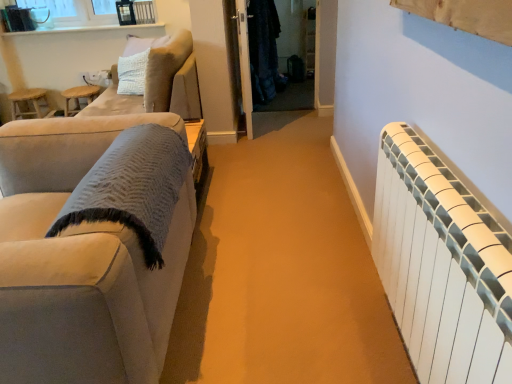
Question: Does wooden stool at left have a lesser width compared to white glossy window sill at upper left?

Choices:
 (A) yes
 (B) no

Answer: (B)

Question: Is wooden stool at left bigger than white glossy window sill at upper left?

Choices:
 (A) no
 (B) yes

Answer: (B)

Question: From the image's perspective, is wooden stool at left beneath white glossy window sill at upper left?

Choices:
 (A) yes
 (B) no

Answer: (A)

Question: Can you confirm if wooden stool at left is smaller than white glossy window sill at upper left?

Choices:
 (A) no
 (B) yes

Answer: (A)

Question: Is wooden stool at left outside white glossy window sill at upper left?

Choices:
 (A) no
 (B) yes

Answer: (B)

Question: From the image's perspective, would you say wooden stool at left is positioned over white glossy window sill at upper left?

Choices:
 (A) yes
 (B) no

Answer: (B)

Question: Does dark matte coat at center lie in front of suede beige armchair at upper left?

Choices:
 (A) no
 (B) yes

Answer: (A)

Question: Considering the relative sizes of dark matte coat at center and suede beige armchair at upper left in the image provided, is dark matte coat at center smaller than suede beige armchair at upper left?

Choices:
 (A) yes
 (B) no

Answer: (A)

Question: Is dark matte coat at center facing away from suede beige armchair at upper left?

Choices:
 (A) no
 (B) yes

Answer: (A)

Question: Is dark matte coat at center at the left side of suede beige armchair at upper left?

Choices:
 (A) no
 (B) yes

Answer: (A)

Question: From a real-world perspective, does dark matte coat at center sit lower than suede beige armchair at upper left?

Choices:
 (A) no
 (B) yes

Answer: (A)

Question: Does dark matte coat at center come behind suede beige armchair at upper left?

Choices:
 (A) no
 (B) yes

Answer: (B)

Question: Can you see white glossy window sill at upper left touching wooden stool at left?

Choices:
 (A) no
 (B) yes

Answer: (A)